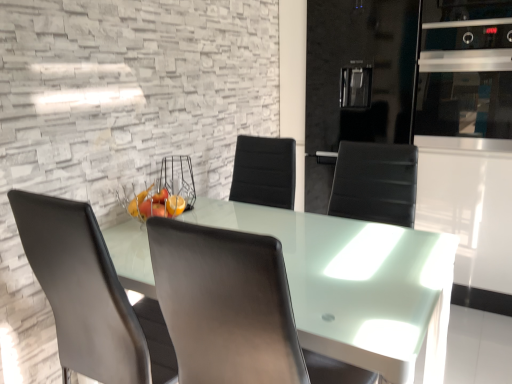
Question: Choose the correct answer: Is matte gray chair at center, the 2th chair in the right-to-left sequence, inside satin silver oven at upper right or outside it?

Choices:
 (A) inside
 (B) outside

Answer: (B)

Question: In the image, is matte gray chair at center, the 2th chair in the right-to-left sequence, on the left side or the right side of satin silver oven at upper right?

Choices:
 (A) right
 (B) left

Answer: (B)

Question: Which object is positioned farthest from the matte gray chair at center, the first chair positioned from the left?

Choices:
 (A) black leather chair at center, arranged as the second chair when viewed from the left
 (B) satin silver oven at upper right

Answer: (B)

Question: Estimate the real-world distances between objects in this image. Which object is closer to the matte gray chair at center, the first chair positioned from the left?

Choices:
 (A) black leather chair at center, positioned as the 1th chair in right-to-left order
 (B) satin silver oven at upper right

Answer: (A)